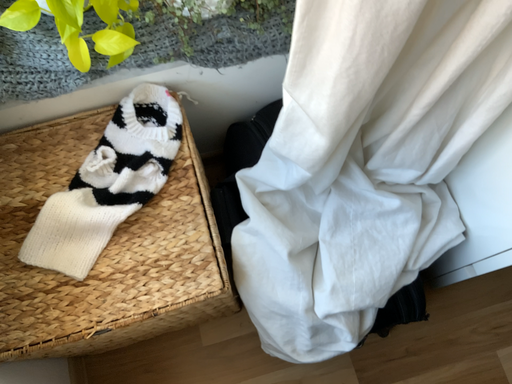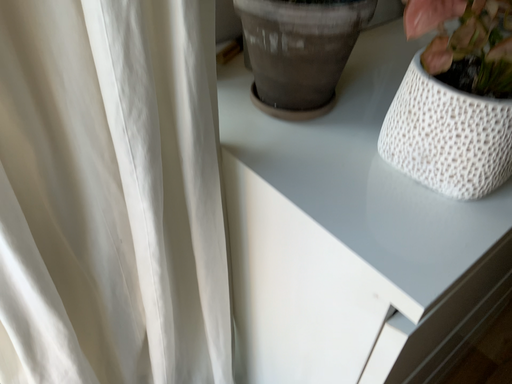
Question: How did the camera likely rotate when shooting the video?

Choices:
 (A) rotated right
 (B) rotated left

Answer: (A)